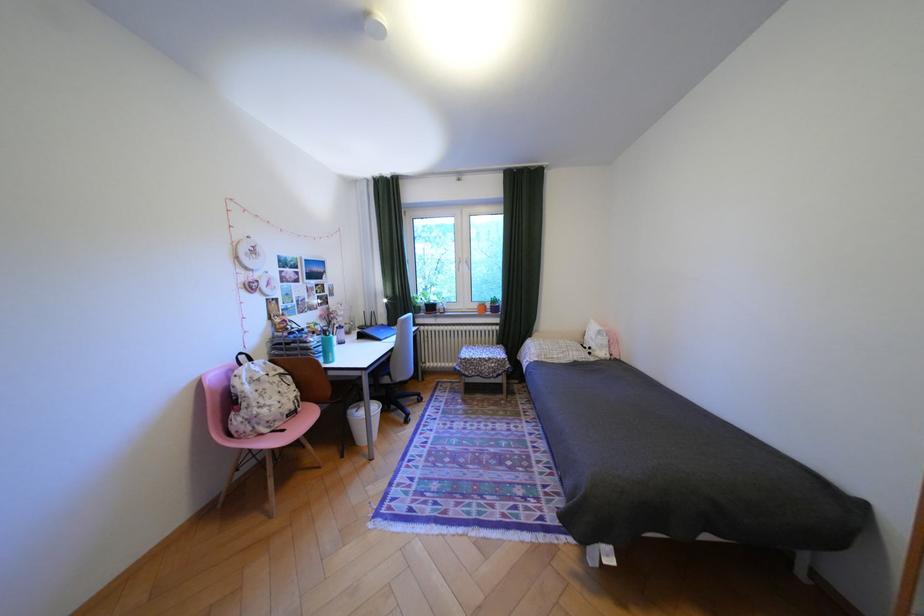
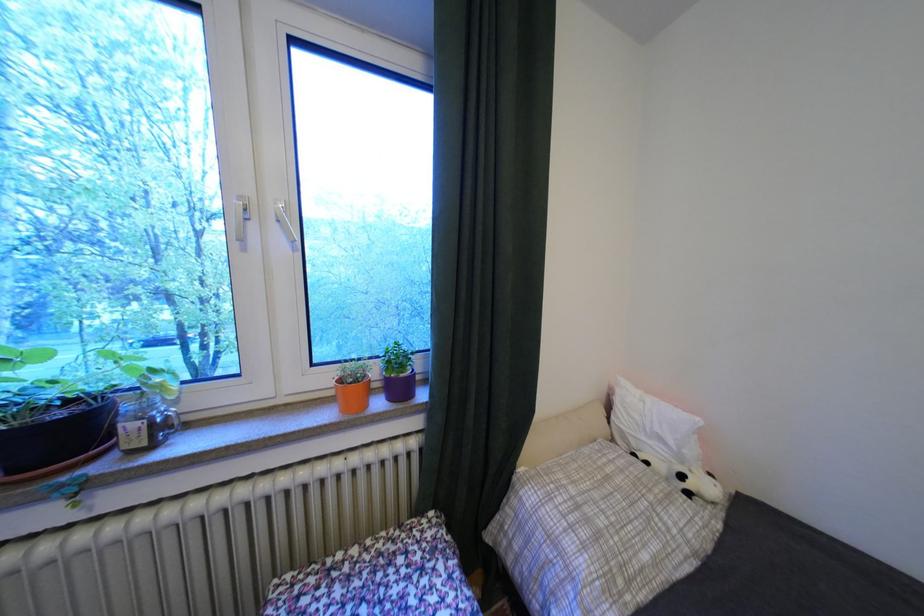
Find the pixel in the second image that matches [570,359] in the first image.

(667, 562)